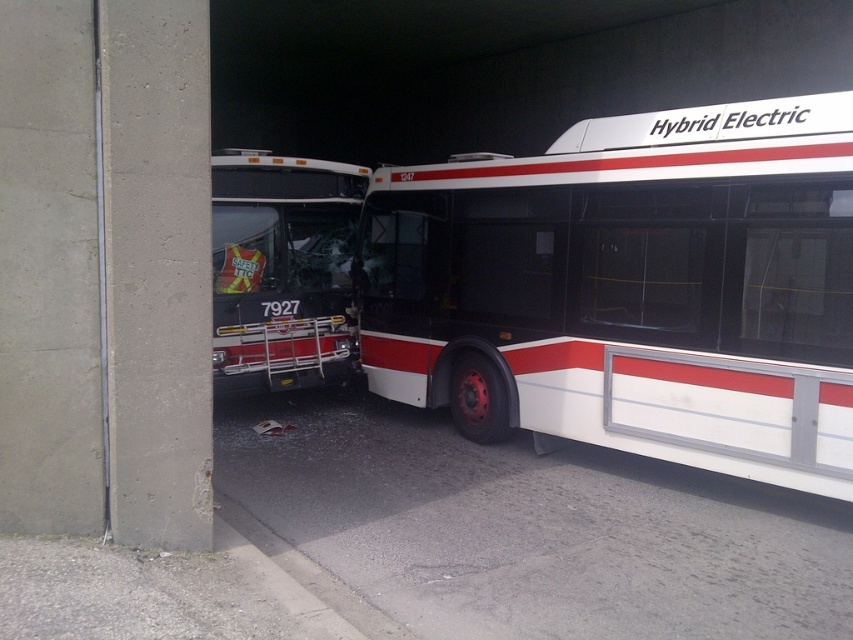
Question: Among these points, which one is nearest to the camera?

Choices:
 (A) (450, 262)
 (B) (323, 352)

Answer: (A)

Question: Does white glossy hybrid electric bus at center have a larger size compared to matte black bus at left?

Choices:
 (A) no
 (B) yes

Answer: (B)

Question: Which point is closer to the camera taking this photo?

Choices:
 (A) (486, 192)
 (B) (245, 196)

Answer: (A)

Question: Where is white glossy hybrid electric bus at center located in relation to matte black bus at left in the image?

Choices:
 (A) right
 (B) left

Answer: (A)

Question: Can you confirm if white glossy hybrid electric bus at center is wider than matte black bus at left?

Choices:
 (A) yes
 (B) no

Answer: (A)